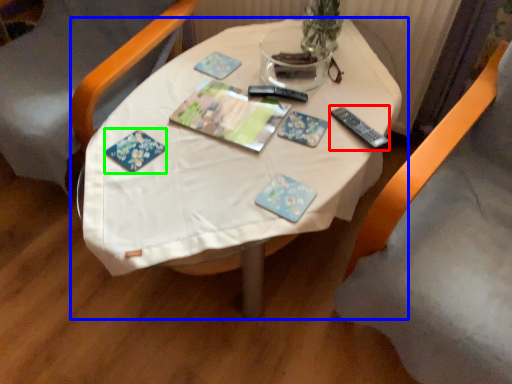
Question: Which is nearer to the remote (highlighted by a red box)? table (highlighted by a blue box) or book (highlighted by a green box).

Choices:
 (A) table
 (B) book

Answer: (A)